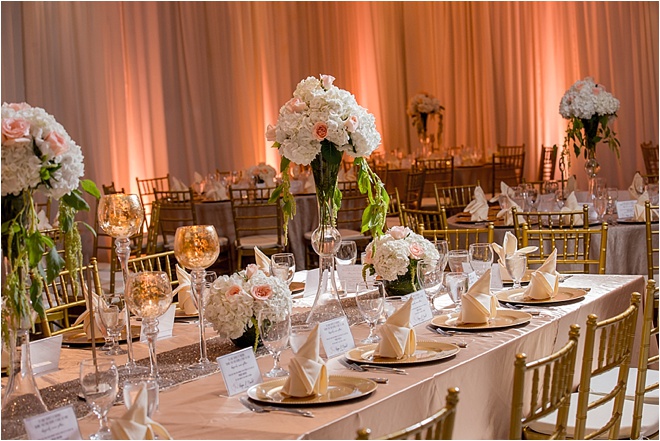
I want to click on chairs of table to the right, so click(x=649, y=229), click(x=585, y=211), click(x=439, y=208), click(x=462, y=196), click(x=558, y=181), click(x=649, y=178).